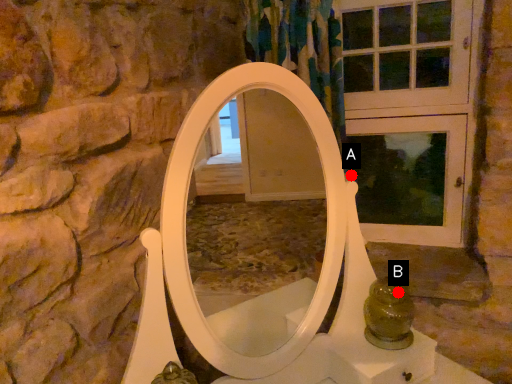
Question: Two points are circled on the image, labeled by A and B beside each circle. Which point is farther to the camera?

Choices:
 (A) A is further
 (B) B is further

Answer: (A)